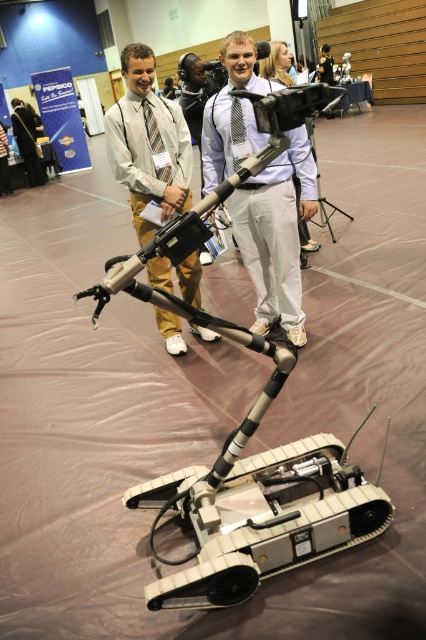
You are a participant at a robotics event and need to locate the robotic device. According to the image, where is the robotic device positioned relative to the matte khaki pants at center marked by point (147, 144)?

The robotic device is positioned in the foreground relative to the matte khaki pants at center marked by point (147, 144).

You are a participant at the robotics event and need to determine which object is bigger between the matte khaki pants at center and the matte black tie at left. Based on the scene, which one is larger?

The matte khaki pants at center has a larger size compared to the matte black tie at left.